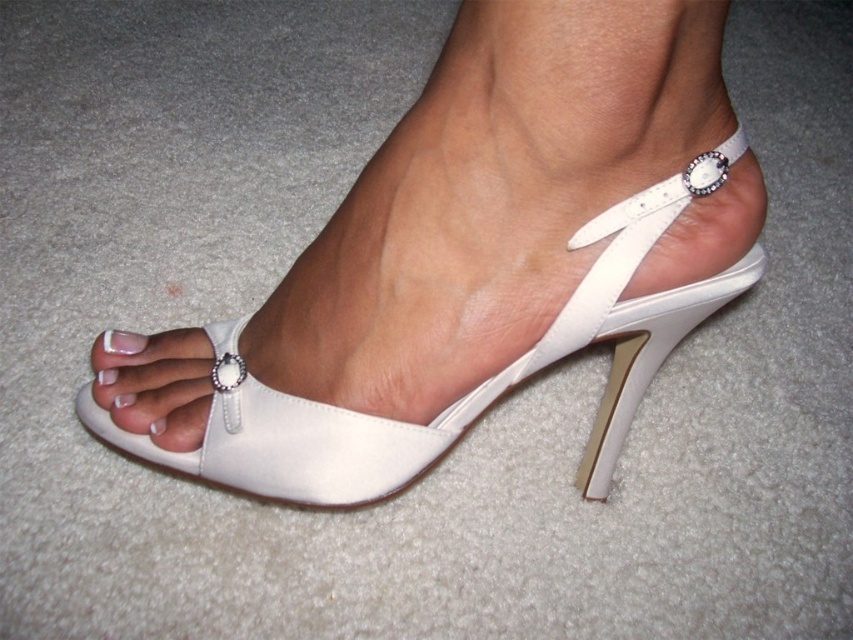
Question: Which object appears closest to the camera in this image?

Choices:
 (A) white satin sandal at center
 (B) white glossy nail at center

Answer: (A)

Question: Does white satin sandal at center have a greater width compared to white glossy nail at center?

Choices:
 (A) yes
 (B) no

Answer: (A)

Question: Does white satin sandal at center have a lesser width compared to white glossy nail at center?

Choices:
 (A) no
 (B) yes

Answer: (A)

Question: Can you confirm if white satin sandal at center is wider than white glossy nail at center?

Choices:
 (A) yes
 (B) no

Answer: (A)